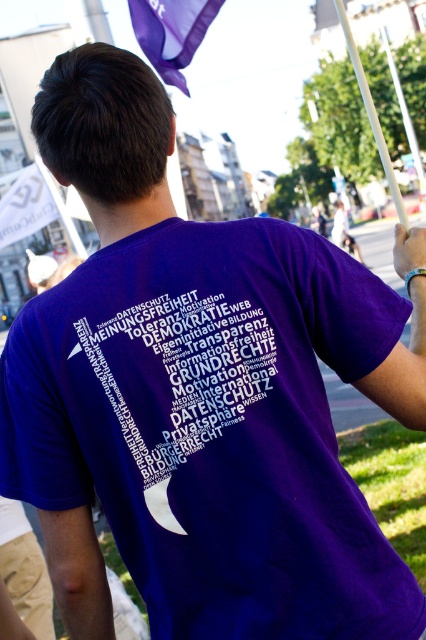
Question: Among these points, which one is farthest from the camera?

Choices:
 (A) (193, 387)
 (B) (187, 88)

Answer: (B)

Question: Is purple fabric shirt at back closer to the viewer compared to purple fabric flag at upper center?

Choices:
 (A) no
 (B) yes

Answer: (B)

Question: Is purple fabric shirt at back positioned before purple fabric flag at upper center?

Choices:
 (A) yes
 (B) no

Answer: (A)

Question: Does purple fabric shirt at back appear under purple fabric flag at upper center?

Choices:
 (A) yes
 (B) no

Answer: (A)

Question: Which point appears closest to the camera in this image?

Choices:
 (A) (152, 355)
 (B) (178, 67)

Answer: (A)